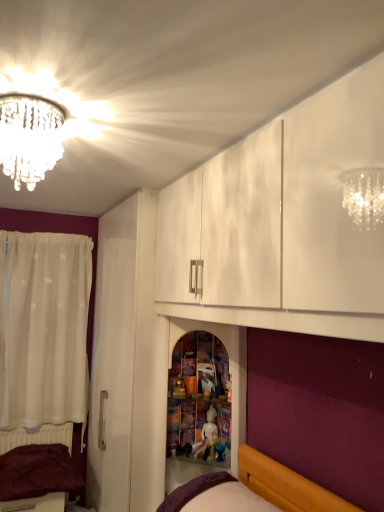
Question: From a real-world perspective, is purple fabric bed at lower left, which is the second bed from front to back, on top of wooden shelf at center?

Choices:
 (A) no
 (B) yes

Answer: (A)

Question: Are purple fabric bed at lower left, positioned as the first bed in back-to-front order, and wooden shelf at center far apart?

Choices:
 (A) no
 (B) yes

Answer: (B)

Question: Is wooden shelf at center at the back of purple fabric bed at lower left, positioned as the first bed in back-to-front order?

Choices:
 (A) yes
 (B) no

Answer: (B)

Question: Is the position of purple fabric bed at lower left, positioned as the first bed in back-to-front order, less distant than that of wooden shelf at center?

Choices:
 (A) yes
 (B) no

Answer: (B)

Question: Considering the relative sizes of purple fabric bed at lower left, which is the second bed from front to back, and wooden shelf at center in the image provided, is purple fabric bed at lower left, which is the second bed from front to back, shorter than wooden shelf at center?

Choices:
 (A) yes
 (B) no

Answer: (A)

Question: Is white glossy statue at center taller or shorter than crystal chandelier at upper left?

Choices:
 (A) short
 (B) tall

Answer: (B)

Question: Looking at their shapes, would you say white glossy statue at center is wider or thinner than crystal chandelier at upper left?

Choices:
 (A) thin
 (B) wide

Answer: (A)

Question: Visually, is white glossy statue at center positioned to the left or to the right of crystal chandelier at upper left?

Choices:
 (A) left
 (B) right

Answer: (B)

Question: From the image's perspective, relative to crystal chandelier at upper left, is white glossy statue at center above or below?

Choices:
 (A) below
 (B) above

Answer: (A)

Question: Is purple fabric bed at lower center, which ranks as the 2th bed in back-to-front order, situated inside wooden shelf at center or outside?

Choices:
 (A) outside
 (B) inside

Answer: (A)

Question: Looking at the image, does purple fabric bed at lower center, which is the 2th bed from bottom to top, seem bigger or smaller compared to wooden shelf at center?

Choices:
 (A) small
 (B) big

Answer: (A)

Question: From a real-world perspective, relative to wooden shelf at center, is purple fabric bed at lower center, which ranks as the first bed in top-to-bottom order, vertically above or below?

Choices:
 (A) below
 (B) above

Answer: (A)

Question: In the image, is purple fabric bed at lower center, which ranks as the 2th bed in back-to-front order, positioned in front of or behind wooden shelf at center?

Choices:
 (A) front
 (B) behind

Answer: (A)

Question: Considering the positions of wooden shelf at center and purple fabric bed at lower left, the first bed in the bottom-to-top sequence, in the image, is wooden shelf at center wider or thinner than purple fabric bed at lower left, the first bed in the bottom-to-top sequence,?

Choices:
 (A) wide
 (B) thin

Answer: (A)

Question: From the image's perspective, relative to purple fabric bed at lower left, placed as the first bed when sorted from left to right, is wooden shelf at center above or below?

Choices:
 (A) above
 (B) below

Answer: (A)